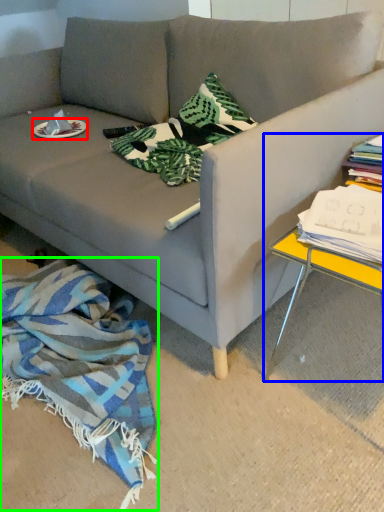
Question: Which object is the closest to the plate (highlighted by a red box)? Choose among these: table (highlighted by a blue box) or blanket (highlighted by a green box).

Choices:
 (A) table
 (B) blanket

Answer: (B)